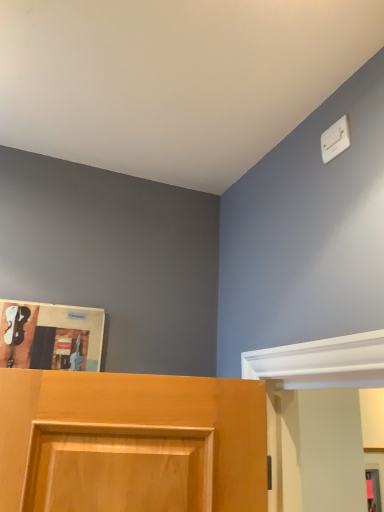
What are the coordinates of `white plastic light switch at upper right` in the screenshot? It's located at (335, 139).

What do you see at coordinates (335, 139) in the screenshot? Image resolution: width=384 pixels, height=512 pixels. I see `white plastic light switch at upper right` at bounding box center [335, 139].

What is the approximate width of white plastic light switch at upper right?

The width of white plastic light switch at upper right is 0.56 inches.

You are a GUI agent. You are given a task and a screenshot of the screen. Output one action in this format:
    pyautogui.click(x=<x>, y=<y>)
    Task: Click on the matte paper magazine at upper left
    
    Given the screenshot: What is the action you would take?
    pyautogui.click(x=51, y=336)

Describe the element at coordinates (51, 336) in the screenshot. I see `matte paper magazine at upper left` at that location.

In order to click on white plastic light switch at upper right in this screenshot , I will do `click(335, 139)`.

Between matte paper magazine at upper left and white plastic light switch at upper right, which one appears on the left side from the viewer's perspective?

Positioned to the left is matte paper magazine at upper left.

Is the position of matte paper magazine at upper left less distant than that of white plastic light switch at upper right?

No, the depth of matte paper magazine at upper left is greater than that of white plastic light switch at upper right.

Which is behind, point (89, 312) or point (322, 149)?

The point (89, 312) is farther from the camera.

From the image's perspective, is matte paper magazine at upper left positioned above or below white plastic light switch at upper right?

matte paper magazine at upper left is below white plastic light switch at upper right.

In the scene shown: From a real-world perspective, is matte paper magazine at upper left below white plastic light switch at upper right?

Indeed, from a real-world perspective, matte paper magazine at upper left is positioned beneath white plastic light switch at upper right.

Looking at their sizes, would you say matte paper magazine at upper left is wider or thinner than white plastic light switch at upper right?

In the image, matte paper magazine at upper left appears to be wider than white plastic light switch at upper right.

Does matte paper magazine at upper left have a greater height compared to white plastic light switch at upper right?

Yes, matte paper magazine at upper left is taller than white plastic light switch at upper right.

Does matte paper magazine at upper left have a larger size compared to white plastic light switch at upper right?

Indeed, matte paper magazine at upper left has a larger size compared to white plastic light switch at upper right.

Is white plastic light switch at upper right a part of matte paper magazine at upper left?

No, white plastic light switch at upper right is not inside matte paper magazine at upper left.

Is matte paper magazine at upper left directly adjacent to white plastic light switch at upper right?

matte paper magazine at upper left is not next to white plastic light switch at upper right, and they're not touching.

Consider the image. Is matte paper magazine at upper left turned away from white plastic light switch at upper right?

That's not correct — matte paper magazine at upper left is not looking away from white plastic light switch at upper right.

What's the angular difference between matte paper magazine at upper left and white plastic light switch at upper right's facing directions?

87.6 degrees.

How far apart are matte paper magazine at upper left and white plastic light switch at upper right?

matte paper magazine at upper left and white plastic light switch at upper right are 33.45 inches apart from each other.

Find the location of a particular element. magazine beneath the white plastic light switch at upper right (from a real-world perspective) is located at coordinates (51, 336).

Considering the relative positions of white plastic light switch at upper right and matte paper magazine at upper left in the image provided, is white plastic light switch at upper right to the right of matte paper magazine at upper left from the viewer's perspective?

Indeed, white plastic light switch at upper right is positioned on the right side of matte paper magazine at upper left.

Considering the positions of objects white plastic light switch at upper right and matte paper magazine at upper left in the image provided, who is behind, white plastic light switch at upper right or matte paper magazine at upper left?

matte paper magazine at upper left is further away from the camera.

Does point (348, 131) appear closer or farther from the camera than point (84, 322)?

Point (348, 131) is closer to the camera than point (84, 322).

From the image's perspective, is white plastic light switch at upper right positioned above or below matte paper magazine at upper left?

white plastic light switch at upper right is situated higher than matte paper magazine at upper left in the image.

From a real-world perspective, between white plastic light switch at upper right and matte paper magazine at upper left, who is vertically higher?

white plastic light switch at upper right is physically above.

Considering the relative sizes of white plastic light switch at upper right and matte paper magazine at upper left in the image provided, is white plastic light switch at upper right wider than matte paper magazine at upper left?

Incorrect, the width of white plastic light switch at upper right does not surpass that of matte paper magazine at upper left.

In terms of height, does white plastic light switch at upper right look taller or shorter compared to matte paper magazine at upper left?

Considering their sizes, white plastic light switch at upper right has less height than matte paper magazine at upper left.

Who is bigger, white plastic light switch at upper right or matte paper magazine at upper left?

matte paper magazine at upper left is bigger.

Would you say white plastic light switch at upper right contains matte paper magazine at upper left?

No, white plastic light switch at upper right does not contain matte paper magazine at upper left.

Are white plastic light switch at upper right and matte paper magazine at upper left making contact?

No.

Is white plastic light switch at upper right aimed at matte paper magazine at upper left?

No, white plastic light switch at upper right is not facing towards matte paper magazine at upper left.

Can you tell me how much white plastic light switch at upper right and matte paper magazine at upper left differ in facing direction?

87.6 degrees.

How distant is white plastic light switch at upper right from matte paper magazine at upper left?

The distance of white plastic light switch at upper right from matte paper magazine at upper left is 33.45 inches.

Locate an element on the screen. This screenshot has height=512, width=384. light switch on the right side of matte paper magazine at upper left is located at coordinates (335, 139).

Where is `magazine located behind the white plastic light switch at upper right`? Image resolution: width=384 pixels, height=512 pixels. magazine located behind the white plastic light switch at upper right is located at coordinates (51, 336).

The image size is (384, 512). Identify the location of light switch on the right of the matte paper magazine at upper left. (335, 139).